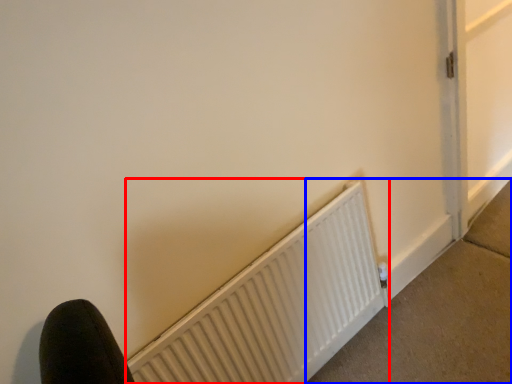
Question: Which of the following is the closest to the observer, radiator (highlighted by a red box) or concrete (highlighted by a blue box)?

Choices:
 (A) radiator
 (B) concrete

Answer: (A)